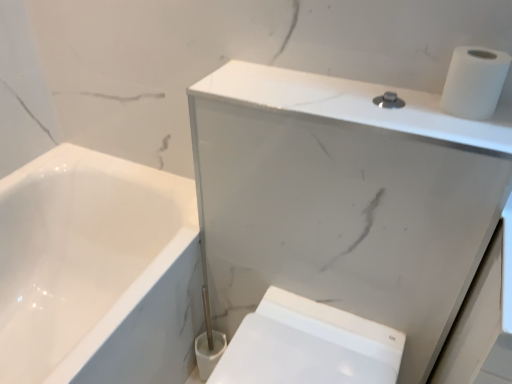
Describe the element at coordinates (344, 199) in the screenshot. I see `white marble cabinet at upper right` at that location.

You are a GUI agent. You are given a task and a screenshot of the screen. Output one action in this format:
    pyautogui.click(x=<x>, y=<y>)
    Task: Click on the white matte toilet paper at upper right
    Image resolution: width=512 pixels, height=384 pixels.
    Given the screenshot: What is the action you would take?
    pyautogui.click(x=474, y=82)

Can you confirm if white marble cabinet at upper right is shorter than white glossy bidet at lower right?

In fact, white marble cabinet at upper right may be taller than white glossy bidet at lower right.

Is point (340, 302) closer or farther from the camera than point (285, 327)?

Point (340, 302) is positioned farther from the camera compared to point (285, 327).

From a real-world perspective, is white marble cabinet at upper right above or below white glossy bidet at lower right?

In terms of real-world spatial position, white marble cabinet at upper right is above white glossy bidet at lower right.

Which object is more forward, white marble cabinet at upper right or white glossy bidet at lower right?

white marble cabinet at upper right is closer to the camera.

Are white glossy bidet at lower right and white matte toilet paper at upper right beside each other?

They are not placed beside each other.

You are a GUI agent. You are given a task and a screenshot of the screen. Output one action in this format:
    pyautogui.click(x=<x>, y=<y>)
    Task: Click on the bidet on the left of white matte toilet paper at upper right
    
    Given the screenshot: What is the action you would take?
    coord(301,353)

Is white glossy bidet at lower right facing away from white matte toilet paper at upper right?

white glossy bidet at lower right does not have its back to white matte toilet paper at upper right.

Consider the image. Can you confirm if white glossy bidet at lower right is shorter than white marble cabinet at upper right?

Yes, white glossy bidet at lower right is shorter than white marble cabinet at upper right.

From a real-world perspective, is white glossy bidet at lower right positioned above or below white marble cabinet at upper right?

white glossy bidet at lower right is situated lower than white marble cabinet at upper right in the real world.

Which object is more forward, white glossy bidet at lower right or white marble cabinet at upper right?

Positioned in front is white marble cabinet at upper right.

Based on their sizes in the image, would you say white matte toilet paper at upper right is bigger or smaller than white marble cabinet at upper right?

In the image, white matte toilet paper at upper right appears to be smaller than white marble cabinet at upper right.

Between point (441, 106) and point (348, 276), which one is positioned in front?

The point (441, 106) is more forward.

Is white matte toilet paper at upper right touching white marble cabinet at upper right?

They are not placed beside each other.

Where is `toilet paper behind the white marble cabinet at upper right`? The image size is (512, 384). toilet paper behind the white marble cabinet at upper right is located at coordinates (474, 82).

Considering the relative sizes of white matte toilet paper at upper right and white glossy bidet at lower right in the image provided, is white matte toilet paper at upper right bigger than white glossy bidet at lower right?

No.

Does white matte toilet paper at upper right appear on the left side of white glossy bidet at lower right?

No, white matte toilet paper at upper right is not to the left of white glossy bidet at lower right.

Can you confirm if white matte toilet paper at upper right is shorter than white glossy bidet at lower right?

Indeed, white matte toilet paper at upper right has a lesser height compared to white glossy bidet at lower right.

Which object is wider, white matte toilet paper at upper right or white glossy bidet at lower right?

white glossy bidet at lower right.

Which of these two, white marble cabinet at upper right or white matte toilet paper at upper right, is smaller?

white matte toilet paper at upper right.

Can you confirm if white marble cabinet at upper right is positioned to the left of white matte toilet paper at upper right?

Yes, white marble cabinet at upper right is to the left of white matte toilet paper at upper right.

Which object is closer to the camera taking this photo, white marble cabinet at upper right or white matte toilet paper at upper right?

white marble cabinet at upper right is more forward.

How different are the orientations of white marble cabinet at upper right and white matte toilet paper at upper right in degrees?

0.293 degrees.

This screenshot has width=512, height=384. What are the coordinates of `bidet behind the white marble cabinet at upper right` in the screenshot? It's located at (x=301, y=353).

Find the location of a particular element. The image size is (512, 384). toilet paper in front of the white glossy bidet at lower right is located at coordinates (474, 82).

Looking at the image, which one is located closer to white marble cabinet at upper right, white glossy bidet at lower right or white matte toilet paper at upper right?

white glossy bidet at lower right is closer to white marble cabinet at upper right.

Which object lies nearer to the anchor point white marble cabinet at upper right, white matte toilet paper at upper right or white glossy bidet at lower right?

Among the two, white glossy bidet at lower right is located nearer to white marble cabinet at upper right.

Looking at the image, which one is located further to white glossy bidet at lower right, white marble cabinet at upper right or white matte toilet paper at upper right?

Among the two, white matte toilet paper at upper right is located further to white glossy bidet at lower right.

Based on their spatial positions, is white matte toilet paper at upper right or white marble cabinet at upper right closer to white glossy bidet at lower right?

Based on the image, white marble cabinet at upper right appears to be nearer to white glossy bidet at lower right.

From the image, which object appears to be farther from white matte toilet paper at upper right, white glossy bidet at lower right or white marble cabinet at upper right?

white glossy bidet at lower right.

Estimate the real-world distances between objects in this image. Which object is closer to white matte toilet paper at upper right, white marble cabinet at upper right or white glossy bidet at lower right?

The object closer to white matte toilet paper at upper right is white marble cabinet at upper right.

This screenshot has width=512, height=384. Identify the location of medicine cabinet between white matte toilet paper at upper right and white glossy bidet at lower right in the up-down direction. (344, 199).